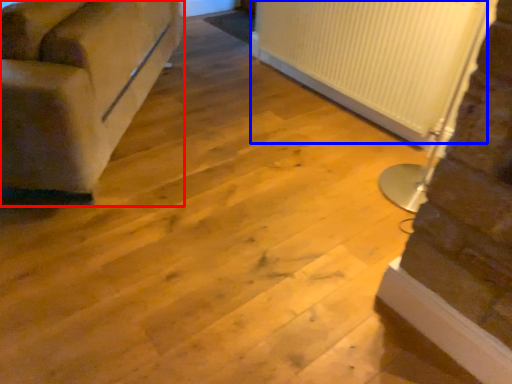
Question: Among these objects, which one is nearest to the camera, studio couch (highlighted by a red box) or radiator (highlighted by a blue box)?

Choices:
 (A) studio couch
 (B) radiator

Answer: (A)